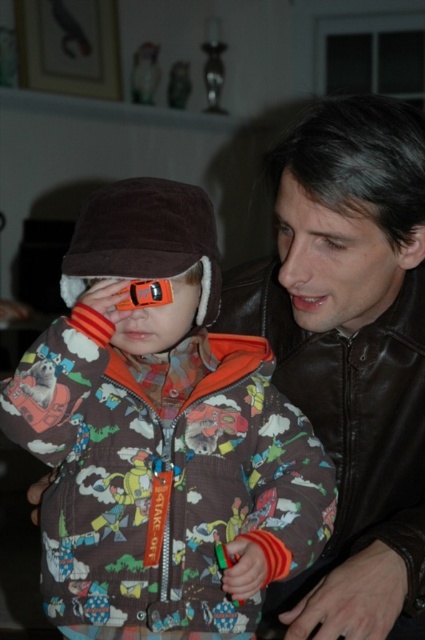
Question: Which point is farther to the camera?

Choices:
 (A) orange plastic goggles at left
 (B) brown fuzzy hat at upper left

Answer: (B)

Question: Is brown fleece jacket at center in front of leather jacket at right?

Choices:
 (A) yes
 (B) no

Answer: (A)

Question: Can you confirm if leather jacket at right is bigger than brown fuzzy hat at upper left?

Choices:
 (A) yes
 (B) no

Answer: (A)

Question: Which object is positioned closest to the brown fuzzy hat at upper left?

Choices:
 (A) brown fleece jacket at center
 (B) orange plastic goggles at left

Answer: (B)

Question: Can you confirm if brown fleece jacket at center is positioned above orange plastic goggles at left?

Choices:
 (A) no
 (B) yes

Answer: (A)

Question: Among these points, which one is farthest from the camera?

Choices:
 (A) (248, 372)
 (B) (223, 307)
 (C) (158, 232)
 (D) (141, 282)

Answer: (B)